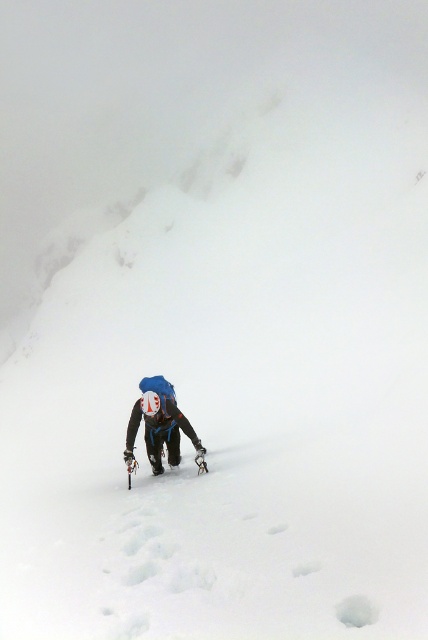
Question: Does blue fabric backpack at center have a smaller size compared to metallic silver ski at center?

Choices:
 (A) yes
 (B) no

Answer: (B)

Question: Which point is closer to the camera?

Choices:
 (A) metallic silver ski at center
 (B) blue fabric backpack at center

Answer: (B)

Question: Is blue fabric backpack at center closer to camera compared to metallic silver ski at center?

Choices:
 (A) yes
 (B) no

Answer: (A)

Question: From the image, what is the correct spatial relationship of blue fabric backpack at center in relation to metallic silver ski at center?

Choices:
 (A) right
 (B) left

Answer: (B)

Question: Which object is closer to the camera taking this photo?

Choices:
 (A) metallic silver ski at center
 (B) blue fabric backpack at center

Answer: (B)